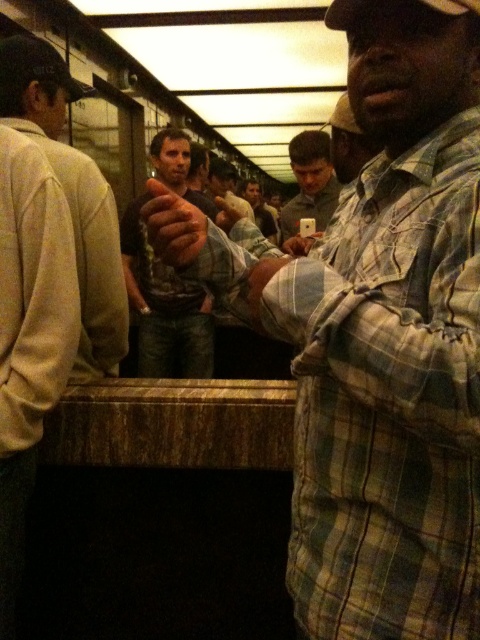
Question: Which is farther from the plaid shirt at center?

Choices:
 (A) matte black shirt at center
 (B) dark brown leather wallet at center
 (C) matte plaid shirt at center
 (D) light beige sweater at left

Answer: (A)

Question: Is dark brown leather wallet at center below matte black shirt at center?

Choices:
 (A) no
 (B) yes

Answer: (B)

Question: Does plaid shirt at center have a greater width compared to matte plaid shirt at center?

Choices:
 (A) no
 (B) yes

Answer: (B)

Question: Which is nearer to the light beige sweater at left?

Choices:
 (A) matte black shirt at center
 (B) dark brown leather wallet at center
 (C) plaid shirt at center
 (D) matte plaid shirt at center

Answer: (C)

Question: Is light beige sweater at left below matte plaid shirt at center?

Choices:
 (A) yes
 (B) no

Answer: (A)

Question: Which object appears closest to the camera in this image?

Choices:
 (A) dark brown leather wallet at center
 (B) matte plaid shirt at center

Answer: (B)